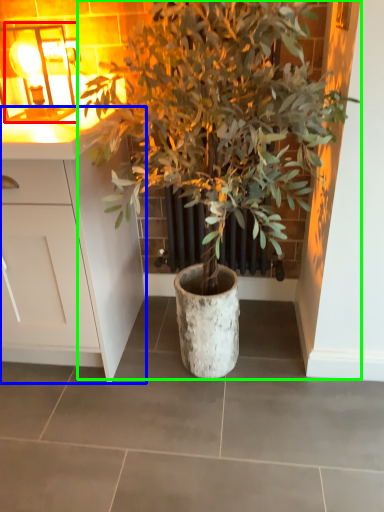
Question: Which is farther away from light fixture (highlighted by a red box)? cabinetry (highlighted by a blue box) or houseplant (highlighted by a green box)?

Choices:
 (A) cabinetry
 (B) houseplant

Answer: (B)